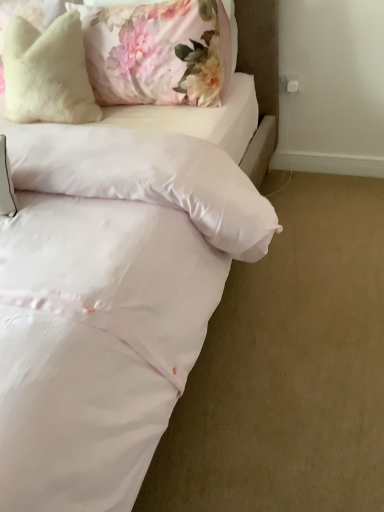
The width and height of the screenshot is (384, 512). I want to click on white satin bed at center, so click(110, 297).

This screenshot has height=512, width=384. In order to click on fluffy white pillow at upper left, placed as the 2th pillow when sorted from right to left in this screenshot , I will do `click(47, 73)`.

What is the approximate height of fluffy white pillow at upper left, marked as the second pillow in a left-to-right arrangement?

19.66 inches.

Find the location of a particular element. This screenshot has width=384, height=512. fluffy white pillow at upper left, the 1th pillow positioned from the right is located at coordinates (158, 52).

I want to click on white satin bed at center, so click(x=110, y=297).

You are a GUI agent. You are given a task and a screenshot of the screen. Output one action in this format:
    pyautogui.click(x=<x>, y=<y>)
    Task: Click on the bed that appears below the fluffy white pillow at upper left, placed as the 2th pillow when sorted from right to left (from the image's perspective)
    The image size is (384, 512).
    Given the screenshot: What is the action you would take?
    pyautogui.click(x=110, y=297)

Considering the sizes of objects fluffy white pillow at upper left, arranged as the 1th pillow when viewed from the left, and white satin bed at center in the image provided, who is bigger, fluffy white pillow at upper left, arranged as the 1th pillow when viewed from the left, or white satin bed at center?

white satin bed at center is bigger.

Is fluffy white pillow at upper left, arranged as the 1th pillow when viewed from the left, shorter than white satin bed at center?

Yes, fluffy white pillow at upper left, arranged as the 1th pillow when viewed from the left, is shorter than white satin bed at center.

Which of these two, white satin bed at center or fluffy white pillow at upper left, marked as the second pillow in a left-to-right arrangement, is wider?

white satin bed at center.

Does white satin bed at center lie behind fluffy white pillow at upper left, the 1th pillow positioned from the right?

No.

From a real-world perspective, is white satin bed at center physically located above or below fluffy white pillow at upper left, the 1th pillow positioned from the right?

In terms of real-world spatial position, white satin bed at center is below fluffy white pillow at upper left, the 1th pillow positioned from the right.

Is white satin bed at center not near fluffy white pillow at upper left, the 1th pillow positioned from the right?

No, white satin bed at center is not far from fluffy white pillow at upper left, the 1th pillow positioned from the right.

Can you tell me how much white satin bed at center and fluffy white pillow at upper left, arranged as the 1th pillow when viewed from the left, differ in facing direction?

The facing directions of white satin bed at center and fluffy white pillow at upper left, arranged as the 1th pillow when viewed from the left, are 4.51 degrees apart.

Considering the sizes of objects white satin bed at center and fluffy white pillow at upper left, placed as the 2th pillow when sorted from right to left, in the image provided, who is smaller, white satin bed at center or fluffy white pillow at upper left, placed as the 2th pillow when sorted from right to left,?

fluffy white pillow at upper left, placed as the 2th pillow when sorted from right to left.

Considering the sizes of objects white satin bed at center and fluffy white pillow at upper left, placed as the 2th pillow when sorted from right to left, in the image provided, who is shorter, white satin bed at center or fluffy white pillow at upper left, placed as the 2th pillow when sorted from right to left,?

fluffy white pillow at upper left, placed as the 2th pillow when sorted from right to left.

Which is less distant, (x=145, y=147) or (x=43, y=35)?

Clearly, point (x=145, y=147) is closer to the camera than point (x=43, y=35).

Which of these two, fluffy white pillow at upper left, the 1th pillow positioned from the right, or fluffy white pillow at upper left, arranged as the 1th pillow when viewed from the left, is thinner?

Thinner between the two is fluffy white pillow at upper left, the 1th pillow positioned from the right.

How much distance is there between fluffy white pillow at upper left, the 1th pillow positioned from the right, and fluffy white pillow at upper left, arranged as the 1th pillow when viewed from the left?

The distance of fluffy white pillow at upper left, the 1th pillow positioned from the right, from fluffy white pillow at upper left, arranged as the 1th pillow when viewed from the left, is 24.42 centimeters.

Which is more to the right, fluffy white pillow at upper left, marked as the second pillow in a left-to-right arrangement, or fluffy white pillow at upper left, placed as the 2th pillow when sorted from right to left?

fluffy white pillow at upper left, marked as the second pillow in a left-to-right arrangement, is more to the right.

Are fluffy white pillow at upper left, the 1th pillow positioned from the right, and fluffy white pillow at upper left, arranged as the 1th pillow when viewed from the left, located far from each other?

fluffy white pillow at upper left, the 1th pillow positioned from the right, is near fluffy white pillow at upper left, arranged as the 1th pillow when viewed from the left, not far away.

In the image, is fluffy white pillow at upper left, marked as the second pillow in a left-to-right arrangement, on the left side or the right side of white satin bed at center?

Based on their positions, fluffy white pillow at upper left, marked as the second pillow in a left-to-right arrangement, is located to the right of white satin bed at center.

Can you confirm if fluffy white pillow at upper left, marked as the second pillow in a left-to-right arrangement, is smaller than white satin bed at center?

Yes.

From the image's perspective, which object appears higher, fluffy white pillow at upper left, marked as the second pillow in a left-to-right arrangement, or white satin bed at center?

fluffy white pillow at upper left, marked as the second pillow in a left-to-right arrangement.

In the scene shown: Could you tell me if fluffy white pillow at upper left, arranged as the 1th pillow when viewed from the left, is turned towards fluffy white pillow at upper left, the 1th pillow positioned from the right?

No, fluffy white pillow at upper left, arranged as the 1th pillow when viewed from the left, does not turn towards fluffy white pillow at upper left, the 1th pillow positioned from the right.

Can you tell me how much fluffy white pillow at upper left, arranged as the 1th pillow when viewed from the left, and fluffy white pillow at upper left, the 1th pillow positioned from the right, differ in facing direction?

The angular difference between fluffy white pillow at upper left, arranged as the 1th pillow when viewed from the left, and fluffy white pillow at upper left, the 1th pillow positioned from the right, is 9.1 degrees.

Which is in front, point (10, 109) or point (97, 96)?

The point (10, 109) is in front.

From a real-world perspective, is fluffy white pillow at upper left, placed as the 2th pillow when sorted from right to left, located beneath fluffy white pillow at upper left, the 1th pillow positioned from the right?

Yes, from a real-world perspective, fluffy white pillow at upper left, placed as the 2th pillow when sorted from right to left, is beneath fluffy white pillow at upper left, the 1th pillow positioned from the right.

Image resolution: width=384 pixels, height=512 pixels. I want to click on bed located below the fluffy white pillow at upper left, arranged as the 1th pillow when viewed from the left (from the image's perspective), so click(x=110, y=297).

Where is `bed that is on the left side of fluffy white pillow at upper left, marked as the second pillow in a left-to-right arrangement`? The width and height of the screenshot is (384, 512). bed that is on the left side of fluffy white pillow at upper left, marked as the second pillow in a left-to-right arrangement is located at coordinates (110, 297).

When comparing their distances from fluffy white pillow at upper left, placed as the 2th pillow when sorted from right to left, does white satin bed at center or fluffy white pillow at upper left, marked as the second pillow in a left-to-right arrangement, seem further?

white satin bed at center lies further to fluffy white pillow at upper left, placed as the 2th pillow when sorted from right to left, than the other object.

Which object lies further to the anchor point white satin bed at center, fluffy white pillow at upper left, the 1th pillow positioned from the right, or fluffy white pillow at upper left, arranged as the 1th pillow when viewed from the left?

fluffy white pillow at upper left, arranged as the 1th pillow when viewed from the left.

Estimate the real-world distances between objects in this image. Which object is further from fluffy white pillow at upper left, the 1th pillow positioned from the right, fluffy white pillow at upper left, arranged as the 1th pillow when viewed from the left, or white satin bed at center?

white satin bed at center lies further to fluffy white pillow at upper left, the 1th pillow positioned from the right, than the other object.

When comparing their distances from fluffy white pillow at upper left, marked as the second pillow in a left-to-right arrangement, does white satin bed at center or fluffy white pillow at upper left, placed as the 2th pillow when sorted from right to left, seem closer?

Among the two, fluffy white pillow at upper left, placed as the 2th pillow when sorted from right to left, is located nearer to fluffy white pillow at upper left, marked as the second pillow in a left-to-right arrangement.

Considering their positions, is fluffy white pillow at upper left, arranged as the 1th pillow when viewed from the left, positioned further to white satin bed at center than fluffy white pillow at upper left, marked as the second pillow in a left-to-right arrangement?

fluffy white pillow at upper left, arranged as the 1th pillow when viewed from the left, is positioned further to the anchor white satin bed at center.

Estimate the real-world distances between objects in this image. Which object is closer to fluffy white pillow at upper left, placed as the 2th pillow when sorted from right to left, fluffy white pillow at upper left, the 1th pillow positioned from the right, or white satin bed at center?

fluffy white pillow at upper left, the 1th pillow positioned from the right.

The height and width of the screenshot is (512, 384). Find the location of `pillow between white satin bed at center and fluffy white pillow at upper left, arranged as the 1th pillow when viewed from the left, along the z-axis`. pillow between white satin bed at center and fluffy white pillow at upper left, arranged as the 1th pillow when viewed from the left, along the z-axis is located at coordinates pos(158,52).